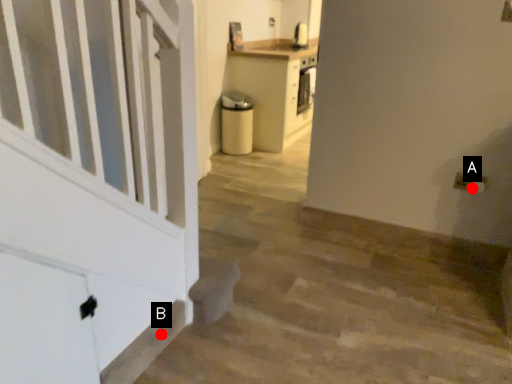
Question: Two points are circled on the image, labeled by A and B beside each circle. Among these points, which one is farthest from the camera?

Choices:
 (A) A is further
 (B) B is further

Answer: (A)